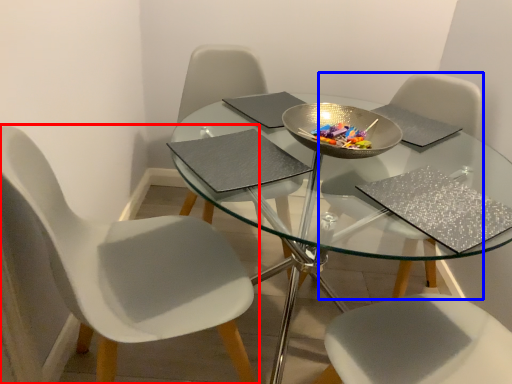
Question: Which object is further to the camera taking this photo, chair (highlighted by a red box) or chair (highlighted by a blue box)?

Choices:
 (A) chair
 (B) chair

Answer: (B)